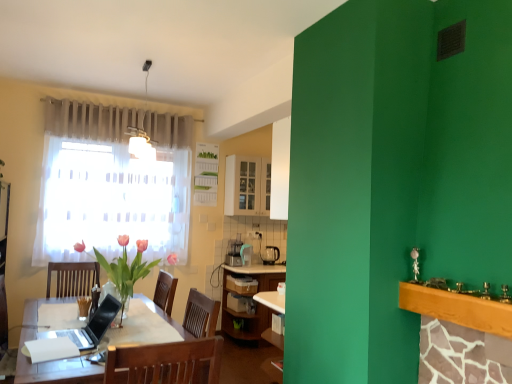
Question: Should I look upward or downward to see white glossy cabinet at upper center?

Choices:
 (A) down
 (B) up

Answer: (B)

Question: Is pink glass vase at left further to camera compared to wooden mantle at upper right?

Choices:
 (A) no
 (B) yes

Answer: (B)

Question: Considering the relative sizes of pink glass vase at left and wooden mantle at upper right in the image provided, is pink glass vase at left taller than wooden mantle at upper right?

Choices:
 (A) no
 (B) yes

Answer: (B)

Question: Is pink glass vase at left wider than wooden mantle at upper right?

Choices:
 (A) yes
 (B) no

Answer: (A)

Question: Does pink glass vase at left have a lesser width compared to wooden mantle at upper right?

Choices:
 (A) no
 (B) yes

Answer: (A)

Question: Is pink glass vase at left to the right of wooden mantle at upper right from the viewer's perspective?

Choices:
 (A) no
 (B) yes

Answer: (A)

Question: Considering the relative sizes of pink glass vase at left and wooden mantle at upper right in the image provided, is pink glass vase at left shorter than wooden mantle at upper right?

Choices:
 (A) yes
 (B) no

Answer: (B)

Question: Can you confirm if black plastic coffee maker at center is smaller than black glossy laptop at center?

Choices:
 (A) no
 (B) yes

Answer: (B)

Question: Could you tell me if black plastic coffee maker at center is facing black glossy laptop at center?

Choices:
 (A) no
 (B) yes

Answer: (A)

Question: Is black plastic coffee maker at center completely or partially outside of black glossy laptop at center?

Choices:
 (A) no
 (B) yes

Answer: (B)

Question: Is black plastic coffee maker at center bigger than black glossy laptop at center?

Choices:
 (A) no
 (B) yes

Answer: (A)

Question: Is black glossy laptop at center located within black plastic coffee maker at center?

Choices:
 (A) no
 (B) yes

Answer: (A)

Question: Does black plastic coffee maker at center appear on the right side of black glossy laptop at center?

Choices:
 (A) no
 (B) yes

Answer: (B)

Question: Does wooden chair at center lie behind black plastic coffee maker at center?

Choices:
 (A) no
 (B) yes

Answer: (A)